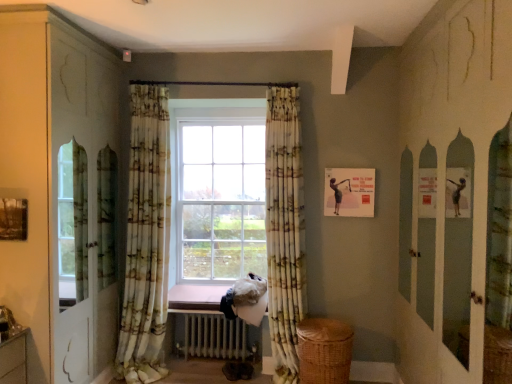
Question: Is the depth of matte paper picture frame at upper right less than that of floral fabric curtain at center, which appears as the 1th curtain when viewed from the left?

Choices:
 (A) no
 (B) yes

Answer: (A)

Question: Is matte paper picture frame at upper right shorter than floral fabric curtain at center, which appears as the 1th curtain when viewed from the left?

Choices:
 (A) no
 (B) yes

Answer: (B)

Question: Is matte paper picture frame at upper right positioned with its back to floral fabric curtain at center, which appears as the 1th curtain when viewed from the left?

Choices:
 (A) yes
 (B) no

Answer: (B)

Question: Does matte paper picture frame at upper right appear on the left side of floral fabric curtain at center, placed as the 2th curtain when sorted from right to left?

Choices:
 (A) no
 (B) yes

Answer: (A)

Question: Is matte paper picture frame at upper right at the right side of floral fabric curtain at center, placed as the 2th curtain when sorted from right to left?

Choices:
 (A) yes
 (B) no

Answer: (A)

Question: Do you think white glossy dresser at left is within floral fabric curtain at center, which appears as the 1th curtain when viewed from the left, or outside of it?

Choices:
 (A) outside
 (B) inside

Answer: (A)

Question: In terms of height, does white glossy dresser at left look taller or shorter compared to floral fabric curtain at center, which appears as the 1th curtain when viewed from the left?

Choices:
 (A) short
 (B) tall

Answer: (B)

Question: Is white glossy dresser at left bigger or smaller than floral fabric curtain at center, placed as the 2th curtain when sorted from right to left?

Choices:
 (A) big
 (B) small

Answer: (A)

Question: From the image's perspective, is white glossy dresser at left above or below floral fabric curtain at center, placed as the 2th curtain when sorted from right to left?

Choices:
 (A) below
 (B) above

Answer: (B)

Question: Considering the positions of matte paper picture frame at upper right and white glossy dresser at left in the image, is matte paper picture frame at upper right bigger or smaller than white glossy dresser at left?

Choices:
 (A) small
 (B) big

Answer: (A)

Question: Is point (366, 213) closer or farther from the camera than point (60, 301)?

Choices:
 (A) farther
 (B) closer

Answer: (A)

Question: In terms of height, does matte paper picture frame at upper right look taller or shorter compared to white glossy dresser at left?

Choices:
 (A) short
 (B) tall

Answer: (A)

Question: Relative to white glossy dresser at left, is matte paper picture frame at upper right in front or behind?

Choices:
 (A) front
 (B) behind

Answer: (B)

Question: Considering the positions of printed fabric curtain at center, positioned as the second curtain in left-to-right order, and white metallic radiator at center in the image, is printed fabric curtain at center, positioned as the second curtain in left-to-right order, bigger or smaller than white metallic radiator at center?

Choices:
 (A) small
 (B) big

Answer: (B)

Question: In terms of width, does printed fabric curtain at center, which appears as the first curtain when viewed from the right, look wider or thinner when compared to white metallic radiator at center?

Choices:
 (A) wide
 (B) thin

Answer: (B)